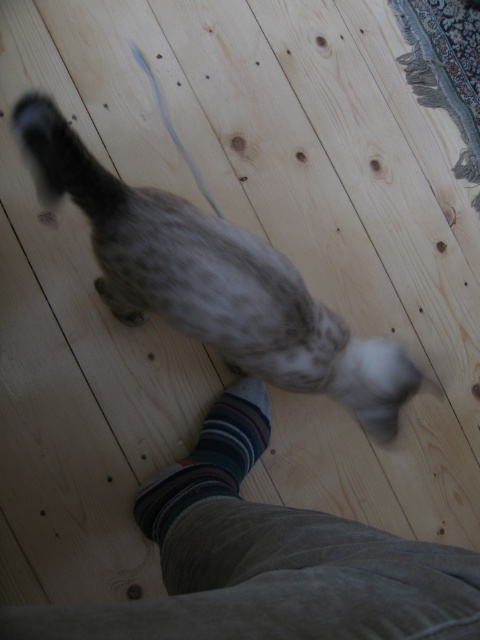
Who is lower down, striped sock at lower center or striped cotton sock at lower center?

striped cotton sock at lower center is lower down.

Does striped sock at lower center have a greater height compared to striped cotton sock at lower center?

No, striped sock at lower center is not taller than striped cotton sock at lower center.

Is point (266, 586) positioned behind point (241, 422)?

No, (266, 586) is in front of (241, 422).

Identify the location of striped sock at lower center. This screenshot has height=640, width=480. (266, 560).

Who is positioned more to the right, striped cotton sock at lower center or fluffy gray tail at lower left?

Positioned to the right is striped cotton sock at lower center.

Which is in front, point (213, 452) or point (117, 202)?

Point (117, 202) is in front.

Where is `striped cotton sock at lower center`? Image resolution: width=480 pixels, height=640 pixels. striped cotton sock at lower center is located at coordinates (210, 460).

Is point (320, 573) more distant than point (275, 292)?

No.

You are a GUI agent. You are given a task and a screenshot of the screen. Output one action in this format:
    pyautogui.click(x=<x>, y=<y>)
    Task: Click on the striped sock at lower center
    This screenshot has width=480, height=640.
    Given the screenshot: What is the action you would take?
    pyautogui.click(x=266, y=560)

In order to click on striped sock at lower center in this screenshot , I will do `click(266, 560)`.